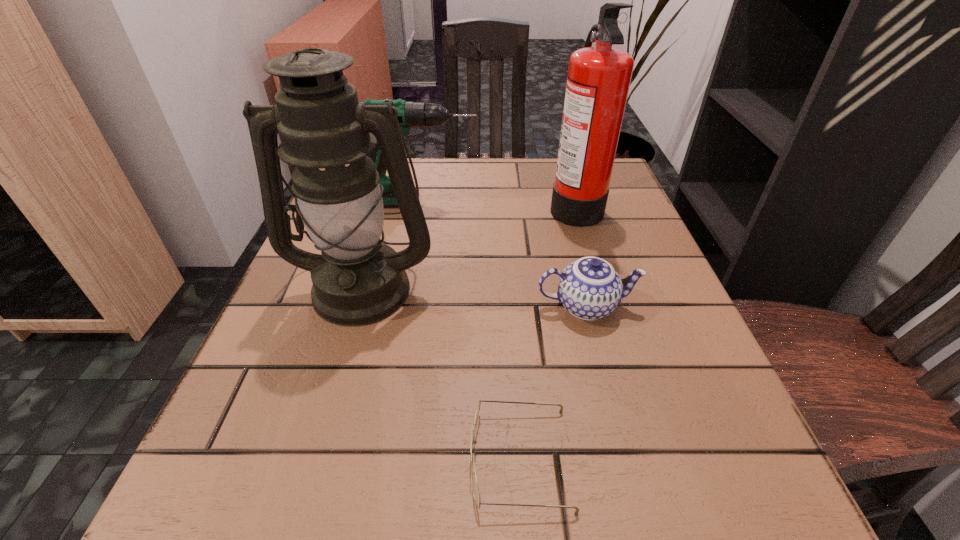
Identify the location of fire extinguisher. The width and height of the screenshot is (960, 540). (x=599, y=77).

Locate an element on the screen. oil lamp is located at coordinates (325, 133).

Where is `the third shortest object`? the third shortest object is located at coordinates (x=410, y=114).

Find the location of a particular element. The height and width of the screenshot is (540, 960). the second shortest object is located at coordinates (590, 288).

This screenshot has height=540, width=960. In order to click on the shortest object in this screenshot , I will do `click(476, 493)`.

Locate an element on the screen. spectacles is located at coordinates (476, 493).

The image size is (960, 540). I want to click on vacant region located on the front-facing side of the fire extinguisher, so click(x=381, y=205).

You are a GUI agent. You are given a task and a screenshot of the screen. Output one action in this format:
    pyautogui.click(x=<x>, y=<y>)
    Task: Click on the free spot located 0.080m on the front-facing side of the fire extinguisher
    This screenshot has width=960, height=540.
    Given the screenshot: What is the action you would take?
    [514, 205]

Identify the location of free space located on the front-facing side of the fire extinguisher. This screenshot has height=540, width=960. (385, 205).

I want to click on vacant area situated 0.230m on the right of the oil lamp, so click(x=564, y=287).